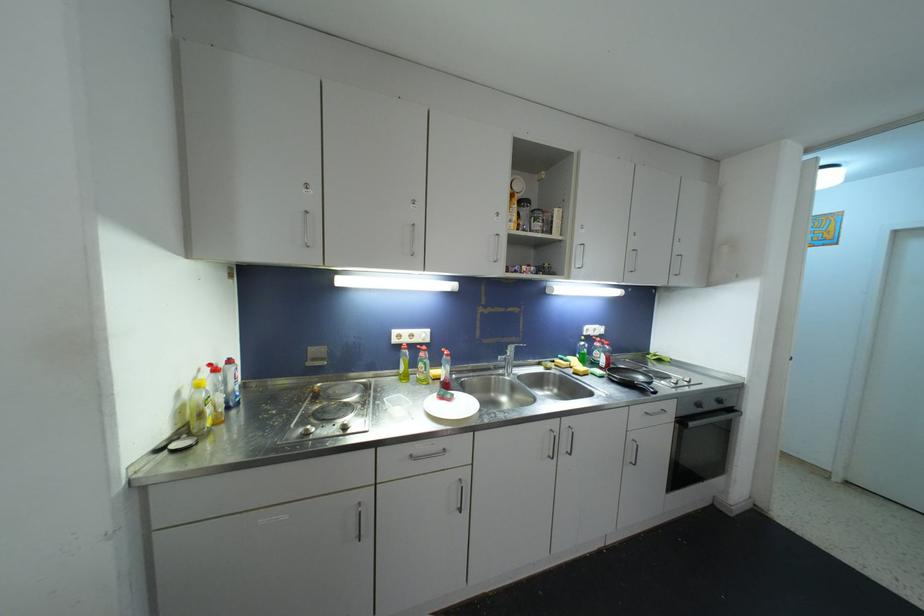
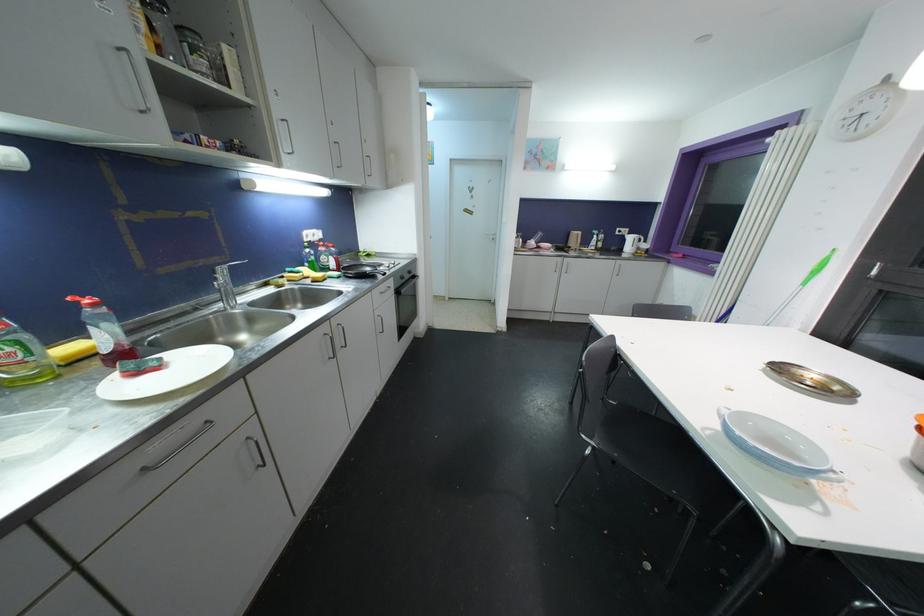
In the second image, find the point that corresponds to (439,374) in the first image.

(69, 350)